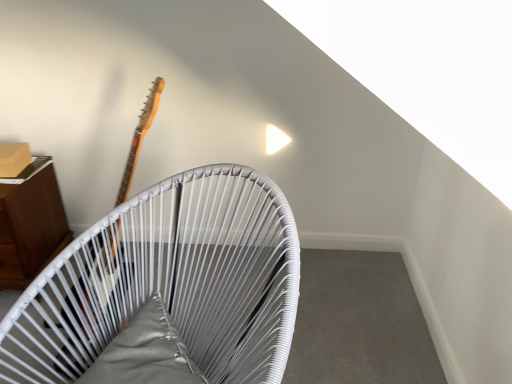
Question: From a real-world perspective, is wooden cabinet at left, which is counted as the first furniture, starting from the left, physically located above or below white woven chair at upper center, which is counted as the second furniture, starting from the back?

Choices:
 (A) above
 (B) below

Answer: (B)

Question: In terms of height, does wooden cabinet at left, which is the first furniture in back-to-front order, look taller or shorter compared to white woven chair at upper center, marked as the first furniture in a front-to-back arrangement?

Choices:
 (A) tall
 (B) short

Answer: (B)

Question: Estimate the real-world distances between objects in this image. Which object is closer to the wooden cabinet at left, which is counted as the first furniture, starting from the left?

Choices:
 (A) wooden guitar at left
 (B) white woven chair at upper center, which is counted as the 2th furniture, starting from the left

Answer: (A)

Question: Estimate the real-world distances between objects in this image. Which object is closer to the wooden guitar at left?

Choices:
 (A) white woven chair at upper center, which ranks as the first furniture in right-to-left order
 (B) wooden cabinet at left, the second furniture positioned from the front

Answer: (A)